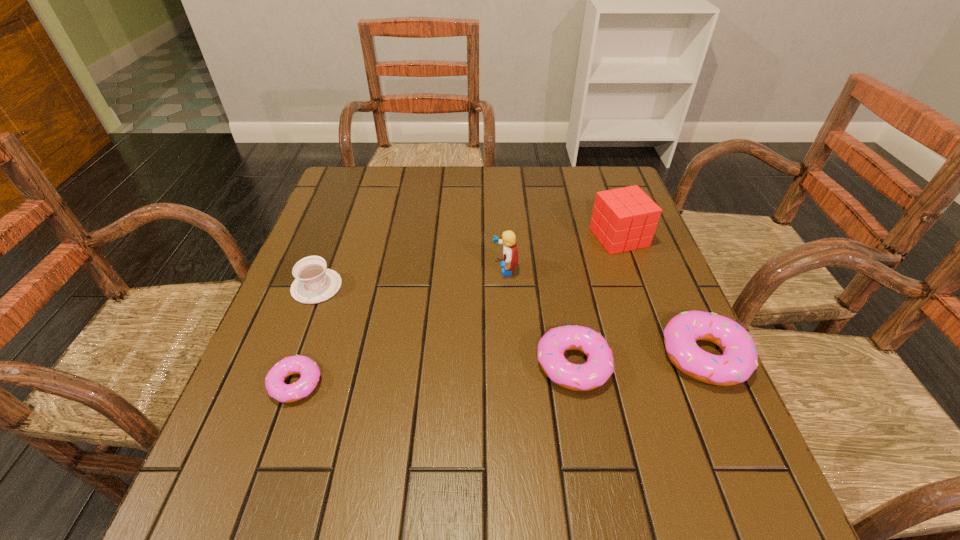
What are the coordinates of `free location that satisfies the following two spatial constraints: 1. on the back side of the second doughnut from left to right; 2. on the front-facing side of the Lego` in the screenshot? It's located at (556, 269).

Image resolution: width=960 pixels, height=540 pixels. I want to click on vacant space that satisfies the following two spatial constraints: 1. on the handle side of the teacup; 2. on the right side of the rightmost doughnut, so click(291, 356).

Where is `vacant space that satisfies the following two spatial constraints: 1. on the handle side of the teacup; 2. on the left side of the shortest object`? vacant space that satisfies the following two spatial constraints: 1. on the handle side of the teacup; 2. on the left side of the shortest object is located at coordinates pos(280,384).

In order to click on free space that satisfies the following two spatial constraints: 1. on the front-facing side of the fourth object from right to left; 2. on the right side of the fourth object from left to right in this screenshot , I will do `click(511, 365)`.